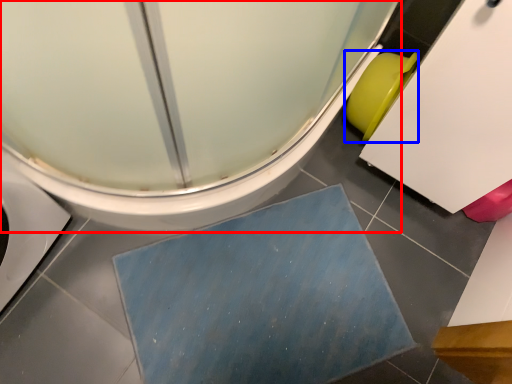
Question: Which object is closer to the camera taking this photo, toilet (highlighted by a red box) or toilet bowl (highlighted by a blue box)?

Choices:
 (A) toilet
 (B) toilet bowl

Answer: (A)